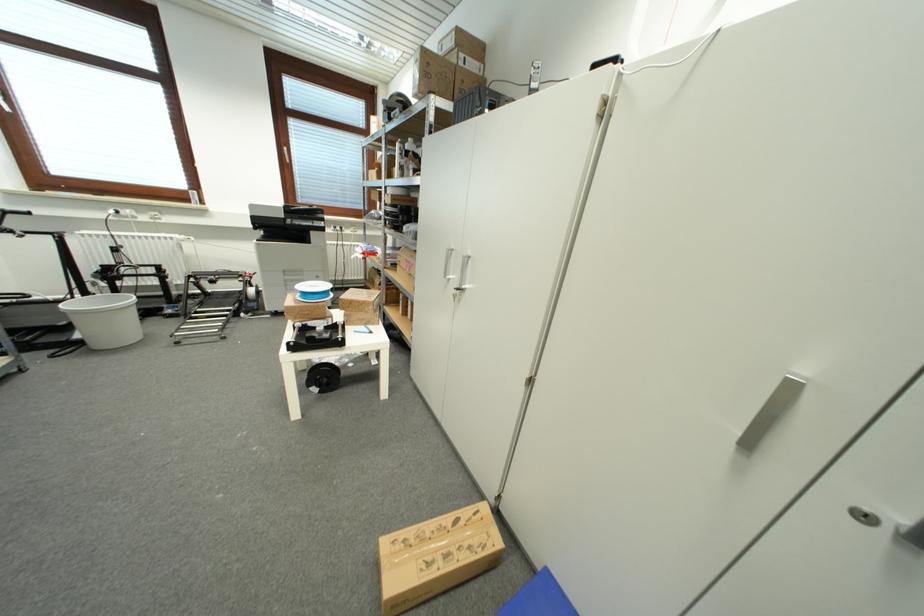
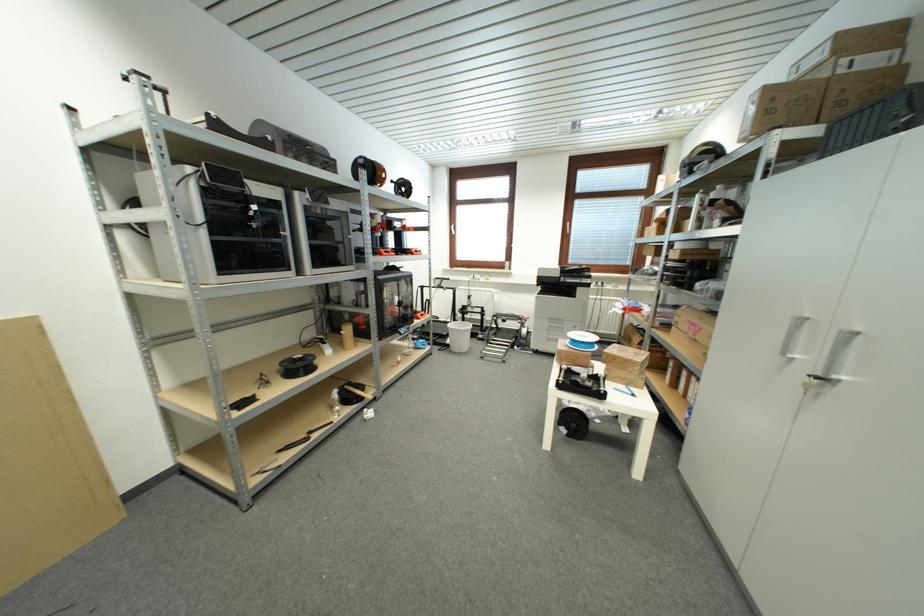
In the second image, find the point that corresponds to pixel 290 172 in the first image.

(569, 241)